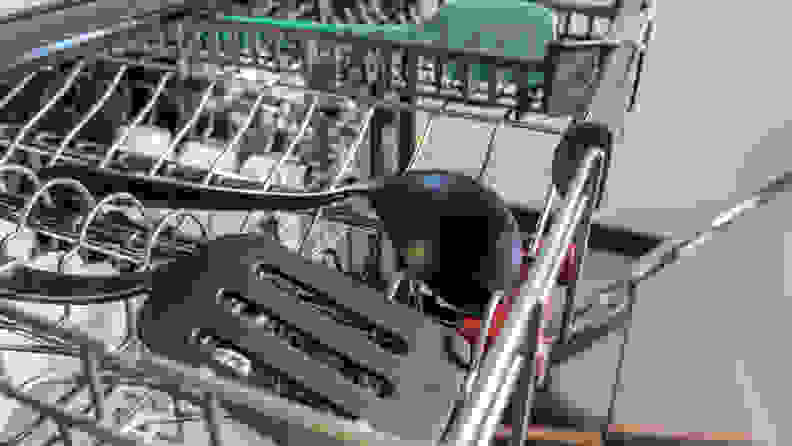
You are a GUI agent. You are given a task and a screenshot of the screen. Output one action in this format:
    pyautogui.click(x=<x>, y=<y>)
    Task: Click on the batter spatula
    
    Given the screenshot: What is the action you would take?
    pyautogui.click(x=509, y=26)